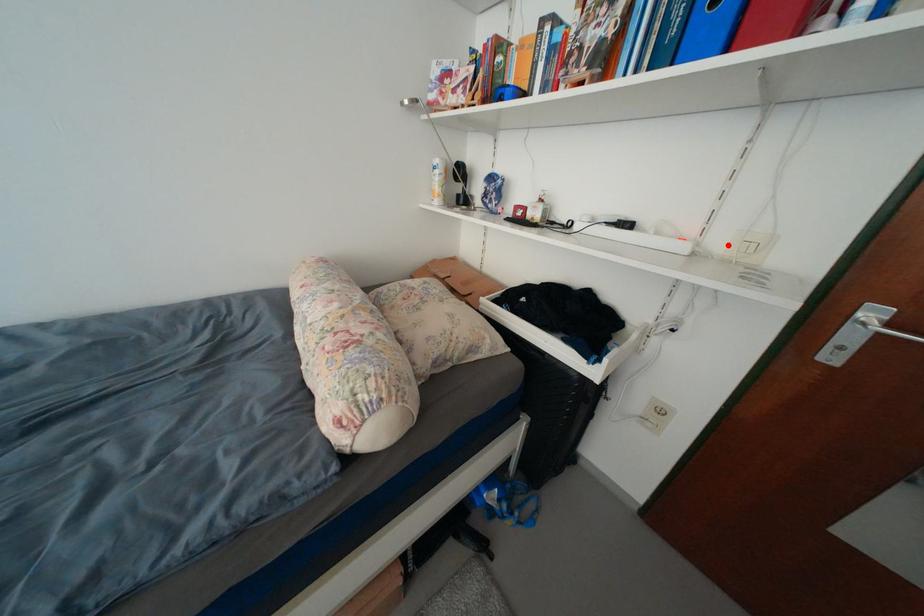
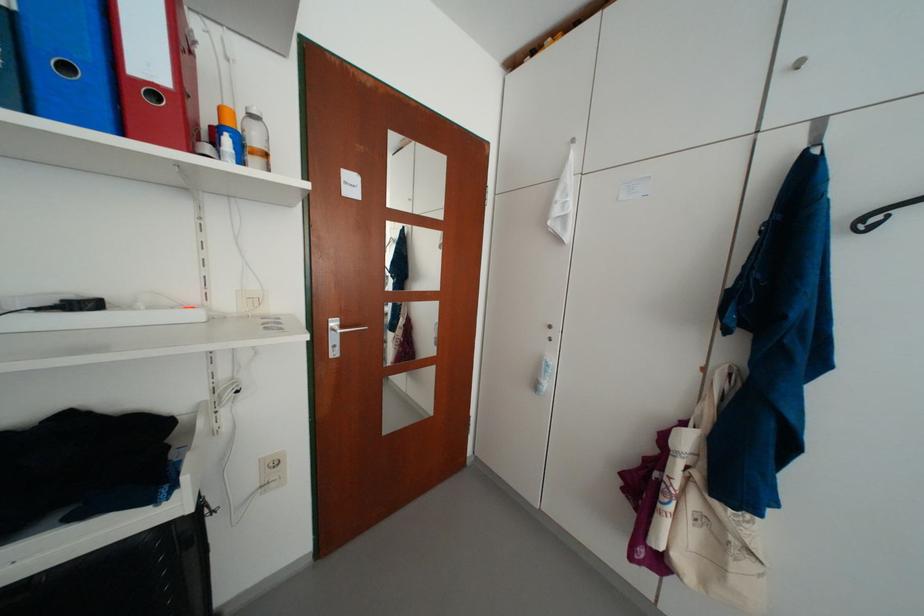
Question: I am providing you with two images of the same scene from different viewpoints. A red point is marked on the first image. At the location where the point appears in image 1, is it still visible in image 2?

Choices:
 (A) Yes
 (B) No

Answer: (A)